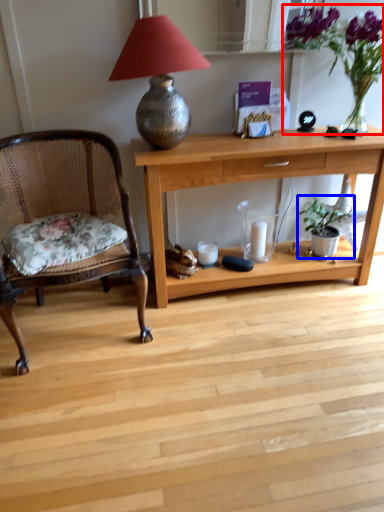
Question: Which of the following is the closest to the observer, floral arrangement (highlighted by a red box) or houseplant (highlighted by a blue box)?

Choices:
 (A) floral arrangement
 (B) houseplant

Answer: (A)